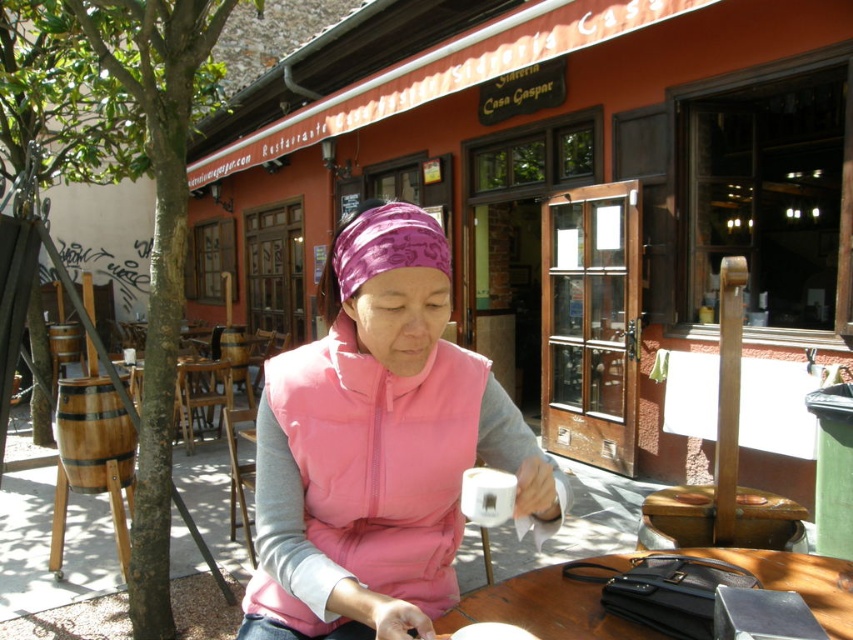
You are a fashion designer observing the scene at the outdoor cafe. You need to determine if the pink matte vest at center can be placed on the wooden table at center without folding it. Can it fit?

The pink matte vest at center is bigger than the wooden table at center, so it cannot fit on the table without folding.

Based on the photo, you are a photographer at the outdoor cafe and want to capture a shot of the woman in her pink matte vest at center and the wooden table at center. From the woman, which direction should you move to get a better angle where both are visible in the frame?

Since the pink matte vest at center is to the left of the wooden table at center, you should move to the right side of the woman to ensure both the pink matte vest at center and the wooden table at center are visible in the frame.